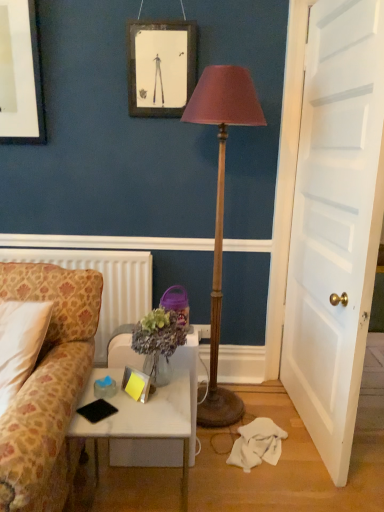
The height and width of the screenshot is (512, 384). What are the coordinates of `vacant space in white wooden door at right (from a real-world perspective)` in the screenshot? It's located at (301, 425).